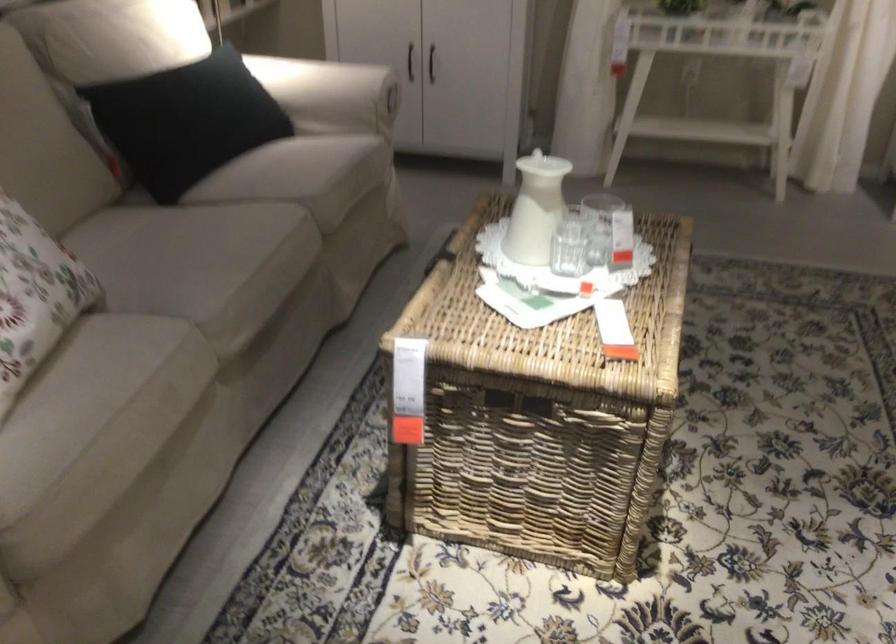
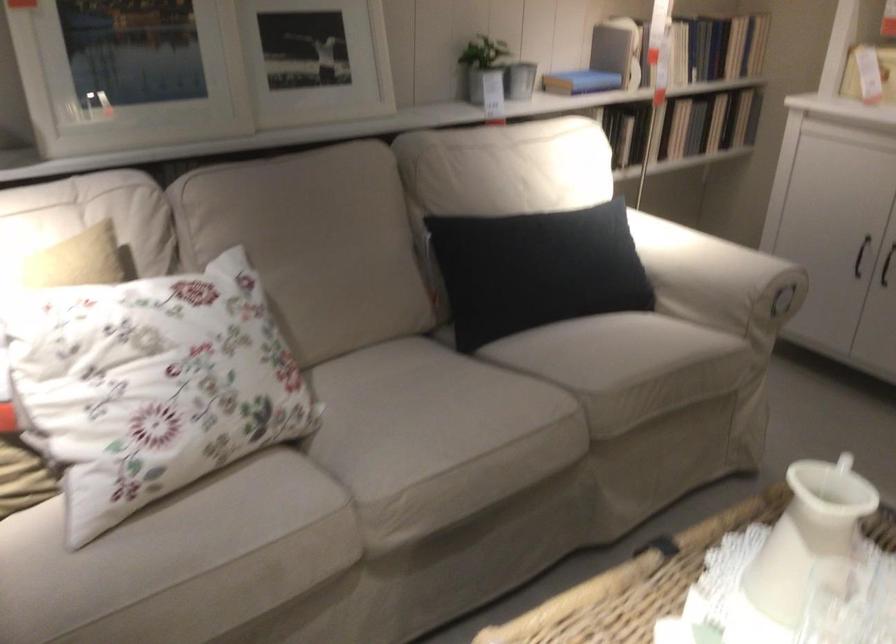
Find the pixel in the second image that matches point (221, 308) in the first image.

(398, 494)